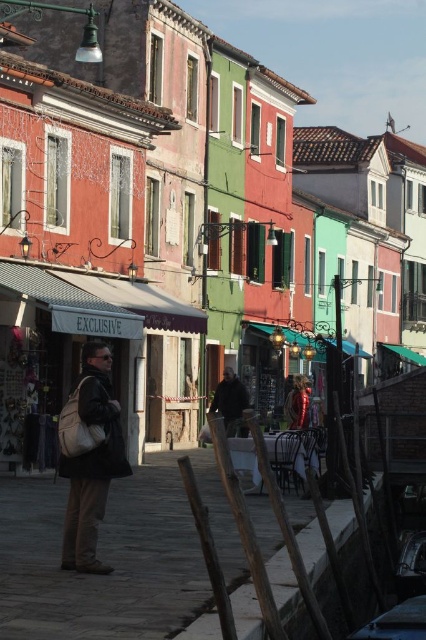
Who is more forward, (94, 531) or (233, 380)?

Positioned in front is point (94, 531).

Can you confirm if matte black backpack at center is smaller than dark gray fabric jacket at center?

Yes.

Is point (74, 461) positioned behind point (242, 397)?

No, (74, 461) is in front of (242, 397).

The image size is (426, 640). What are the coordinates of `matte black backpack at center` in the screenshot? It's located at (89, 458).